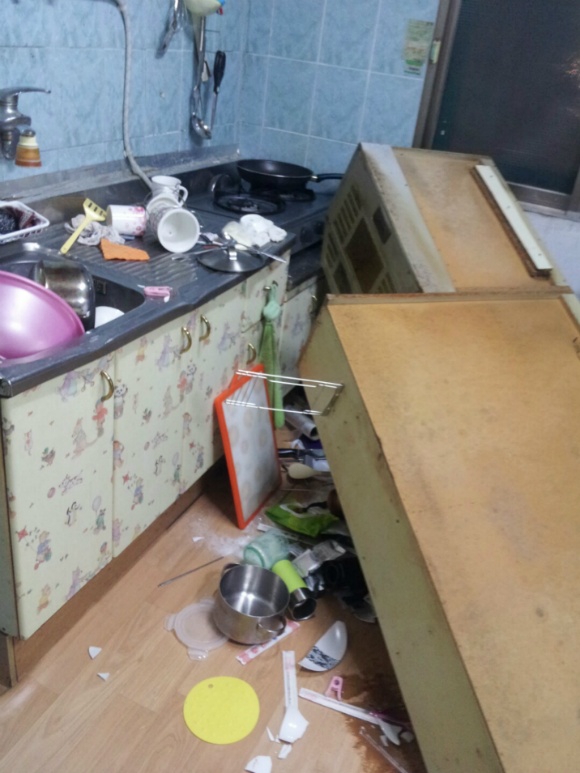
This screenshot has height=773, width=580. Identify the location of blue wall tile. (311, 46).